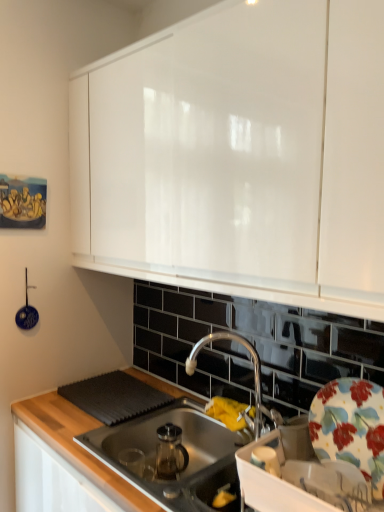
Question: Should I look upward or downward to see stainless steel sink at center?

Choices:
 (A) up
 (B) down

Answer: (B)

Question: Is chrome metallic faucet at center bigger than stainless steel sink at center?

Choices:
 (A) yes
 (B) no

Answer: (B)

Question: From a real-world perspective, is chrome metallic faucet at center physically below stainless steel sink at center?

Choices:
 (A) no
 (B) yes

Answer: (A)

Question: Could you tell me if chrome metallic faucet at center is turned towards stainless steel sink at center?

Choices:
 (A) no
 (B) yes

Answer: (A)

Question: Can you see chrome metallic faucet at center touching stainless steel sink at center?

Choices:
 (A) no
 (B) yes

Answer: (A)

Question: Considering the relative positions of chrome metallic faucet at center and stainless steel sink at center in the image provided, is chrome metallic faucet at center to the left of stainless steel sink at center from the viewer's perspective?

Choices:
 (A) no
 (B) yes

Answer: (A)

Question: Is chrome metallic faucet at center located outside stainless steel sink at center?

Choices:
 (A) yes
 (B) no

Answer: (A)

Question: From the image's perspective, does stainless steel sink at center appear lower than white glossy cabinet at upper center?

Choices:
 (A) yes
 (B) no

Answer: (A)

Question: From a real-world perspective, is stainless steel sink at center located beneath white glossy cabinet at upper center?

Choices:
 (A) yes
 (B) no

Answer: (A)

Question: Can you confirm if stainless steel sink at center is positioned to the right of white glossy cabinet at upper center?

Choices:
 (A) yes
 (B) no

Answer: (B)

Question: Does stainless steel sink at center come behind white glossy cabinet at upper center?

Choices:
 (A) yes
 (B) no

Answer: (A)

Question: Can you confirm if stainless steel sink at center is wider than white glossy cabinet at upper center?

Choices:
 (A) yes
 (B) no

Answer: (A)

Question: Does stainless steel sink at center have a smaller size compared to white glossy cabinet at upper center?

Choices:
 (A) no
 (B) yes

Answer: (B)

Question: Is stainless steel sink at center positioned with its back to chrome metallic faucet at center?

Choices:
 (A) no
 (B) yes

Answer: (A)